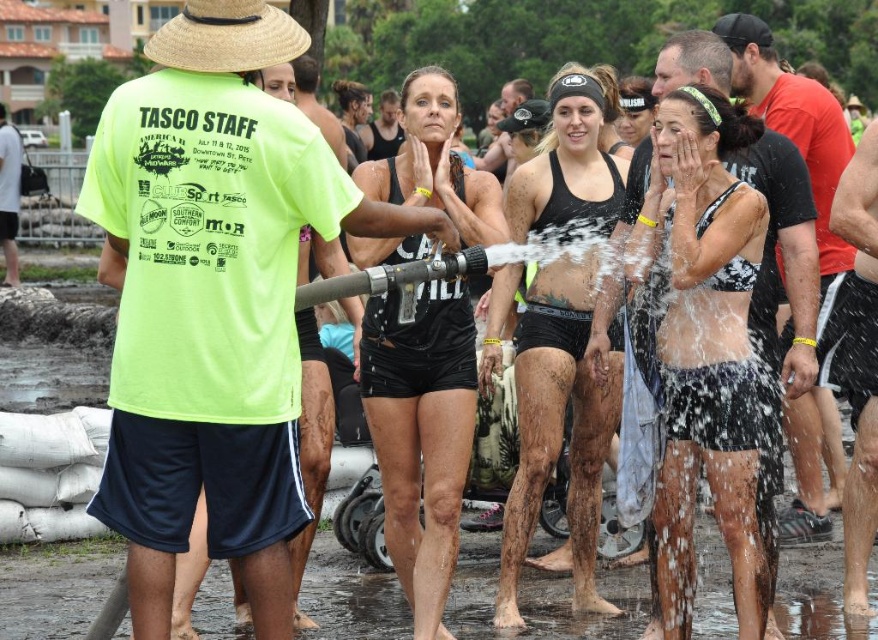
Question: Where is neon yellow t-shirt at center located in relation to black matte shorts at center in the image?

Choices:
 (A) above
 (B) below

Answer: (A)

Question: Is the position of black matte shorts at center less distant than that of straw hat at upper left?

Choices:
 (A) yes
 (B) no

Answer: (B)

Question: Among these points, which one is farthest from the camera?

Choices:
 (A) (265, 51)
 (B) (459, 289)
 (C) (812, 394)
 (D) (610, 104)

Answer: (D)

Question: Estimate the real-world distances between objects in this image. Which object is closer to the black matte shorts at center?

Choices:
 (A) black matte swimsuit at center
 (B) straw hat at upper left
 (C) matte black tank top at center
 (D) neon yellow t-shirt at center

Answer: (A)

Question: Is black matte swimsuit at center smaller than straw hat at upper left?

Choices:
 (A) yes
 (B) no

Answer: (A)

Question: Which point appears farthest from the camera in this image?

Choices:
 (A) (274, 29)
 (B) (234, 12)
 (C) (382, 339)

Answer: (C)